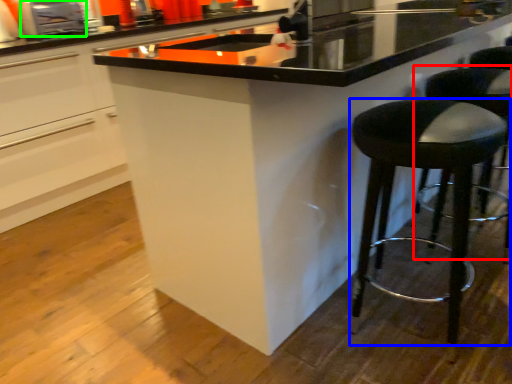
Question: Considering the real-world distances, which object is closest to bar stool (highlighted by a red box)? stool (highlighted by a blue box) or appliance (highlighted by a green box).

Choices:
 (A) stool
 (B) appliance

Answer: (A)